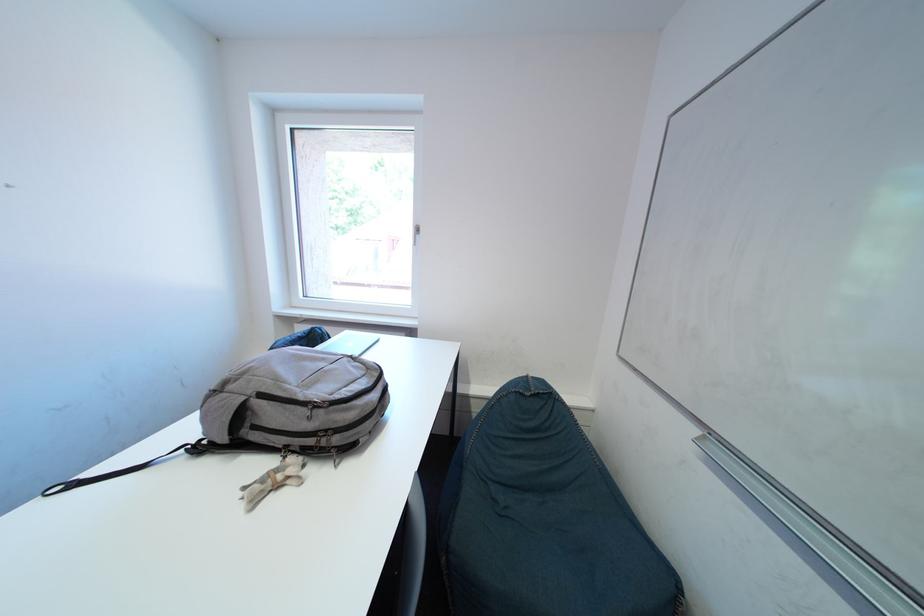
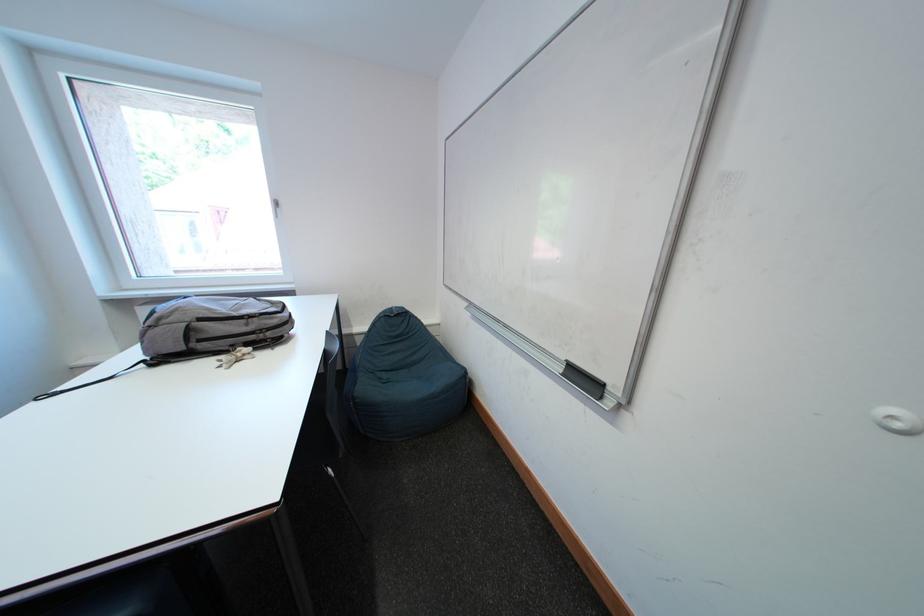
Question: What movement of the cameraman would produce the second image?

Choices:
 (A) Left
 (B) Right
 (C) Forward
 (D) Backward

Answer: (D)